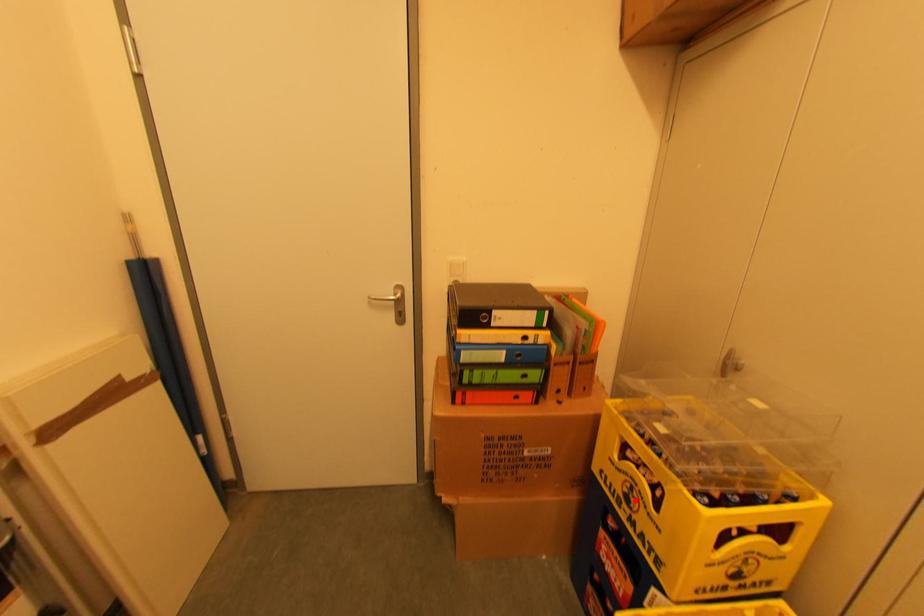
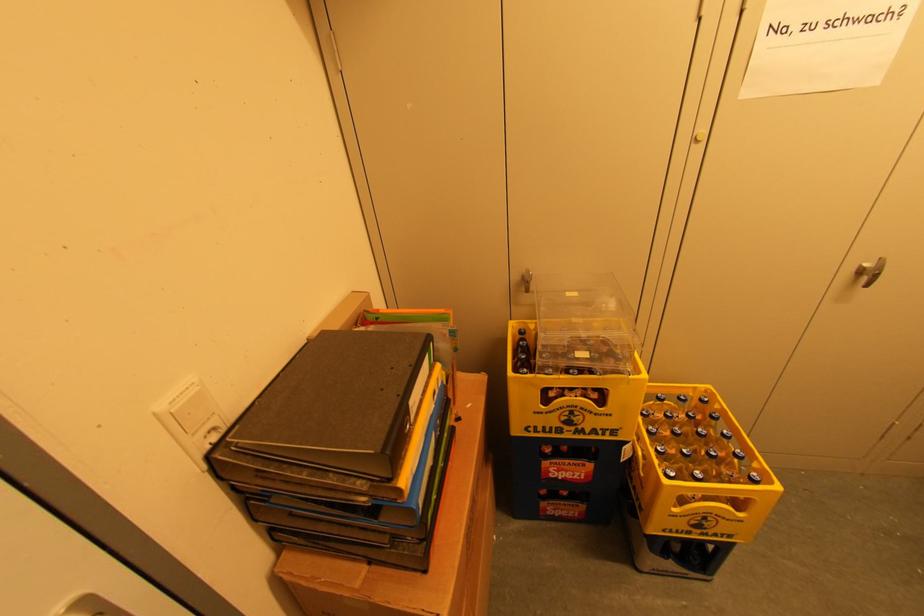
Locate, in the second image, the point that corresponds to the highlighted location in the first image.

(578, 419)